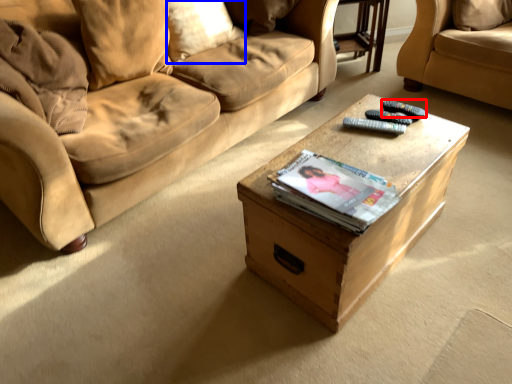
Question: Among these objects, which one is farthest to the camera, remote (highlighted by a red box) or pillow (highlighted by a blue box)?

Choices:
 (A) remote
 (B) pillow

Answer: (B)